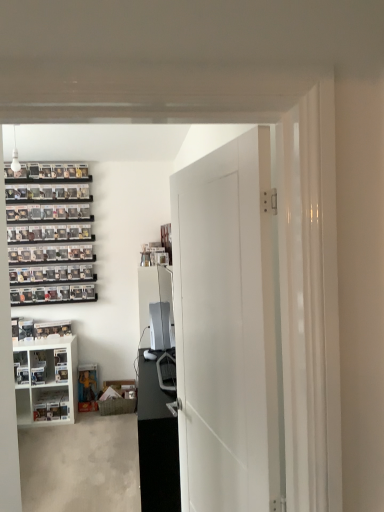
Question: Should I look upward or downward to see white matte door at center?

Choices:
 (A) down
 (B) up

Answer: (A)

Question: From the image's perspective, would you say black glossy entertainment center at center is shown under white matte door at center?

Choices:
 (A) no
 (B) yes

Answer: (B)

Question: Is black glossy entertainment center at center outside white matte door at center?

Choices:
 (A) yes
 (B) no

Answer: (A)

Question: From a real-world perspective, is black glossy entertainment center at center physically below white matte door at center?

Choices:
 (A) no
 (B) yes

Answer: (B)

Question: Is the surface of black glossy entertainment center at center in direct contact with white matte door at center?

Choices:
 (A) no
 (B) yes

Answer: (A)

Question: Could you tell me if black glossy entertainment center at center is turned towards white matte door at center?

Choices:
 (A) no
 (B) yes

Answer: (A)

Question: Can you confirm if black glossy entertainment center at center is positioned to the right of white matte door at center?

Choices:
 (A) yes
 (B) no

Answer: (B)

Question: From a real-world perspective, does black glossy entertainment center at center sit lower than white glossy cabinet at lower left?

Choices:
 (A) yes
 (B) no

Answer: (A)

Question: Is black glossy entertainment center at center oriented away from white glossy cabinet at lower left?

Choices:
 (A) no
 (B) yes

Answer: (A)

Question: Does black glossy entertainment center at center appear on the right side of white glossy cabinet at lower left?

Choices:
 (A) no
 (B) yes

Answer: (B)

Question: From a real-world perspective, is black glossy entertainment center at center on top of white glossy cabinet at lower left?

Choices:
 (A) yes
 (B) no

Answer: (B)

Question: Is black glossy entertainment center at center to the left of white glossy cabinet at lower left from the viewer's perspective?

Choices:
 (A) no
 (B) yes

Answer: (A)

Question: Could you tell me if black glossy entertainment center at center is facing white glossy cabinet at lower left?

Choices:
 (A) no
 (B) yes

Answer: (A)

Question: Considering the relative positions of white matte door at center and black glossy entertainment center at center in the image provided, is white matte door at center to the left of black glossy entertainment center at center from the viewer's perspective?

Choices:
 (A) yes
 (B) no

Answer: (B)